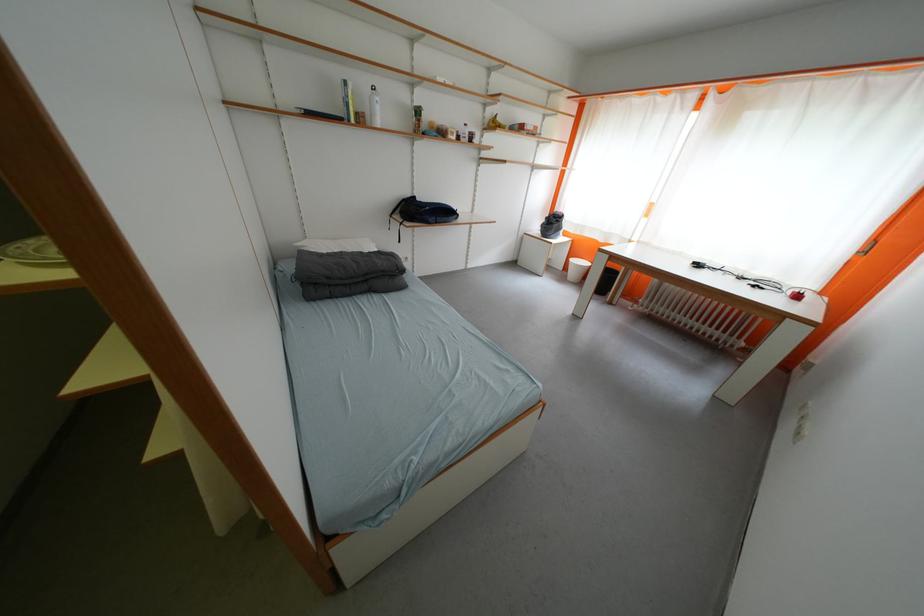
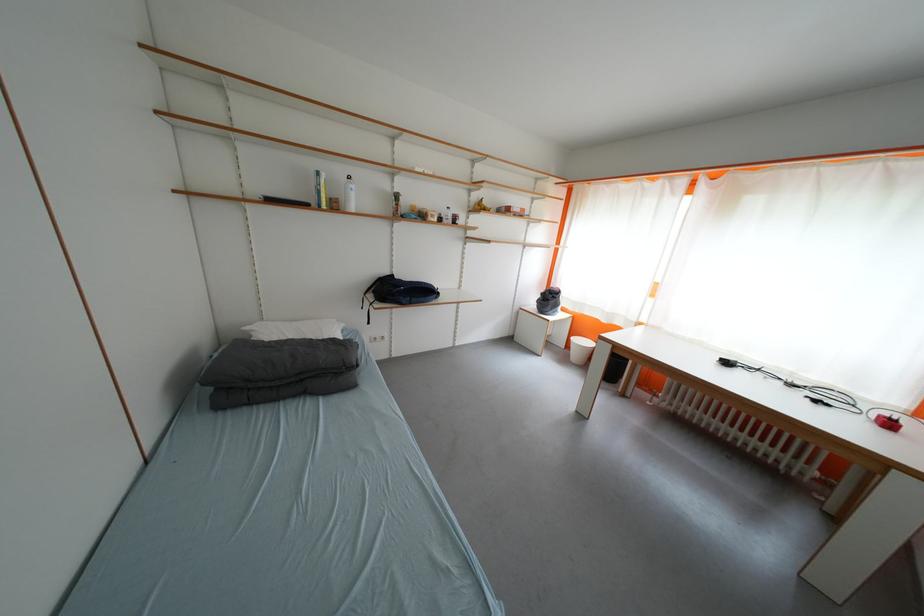
In the second image, find the point that corresponds to the point at 569,277 in the first image.

(572, 358)